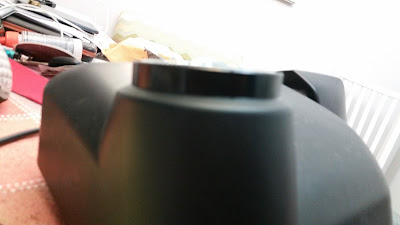
Locate an element on the screen. Image resolution: width=400 pixels, height=225 pixels. table is located at coordinates point(30,109).